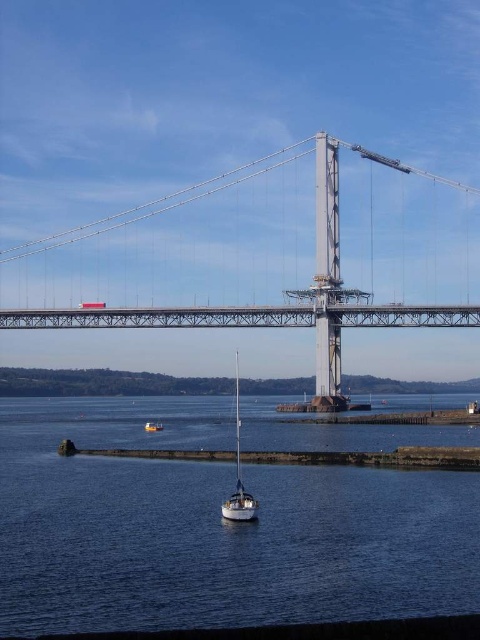
Can you confirm if metallic gray suspension bridge at center is shorter than white glossy sailboat at center?

No, metallic gray suspension bridge at center is not shorter than white glossy sailboat at center.

Is metallic gray suspension bridge at center closer to the viewer compared to white glossy sailboat at center?

That is False.

Locate an element on the screen. The image size is (480, 640). metallic gray suspension bridge at center is located at coordinates (253, 305).

This screenshot has height=640, width=480. I want to click on metallic gray suspension bridge at center, so click(253, 305).

Does white glossy sailboat at center have a larger size compared to orange fiberglass boat at lower center?

Yes, white glossy sailboat at center is bigger than orange fiberglass boat at lower center.

Can you confirm if white glossy sailboat at center is positioned to the left of orange fiberglass boat at lower center?

Incorrect, white glossy sailboat at center is not on the left side of orange fiberglass boat at lower center.

Image resolution: width=480 pixels, height=640 pixels. What do you see at coordinates (239, 476) in the screenshot? I see `white glossy sailboat at center` at bounding box center [239, 476].

Locate an element on the screen. This screenshot has height=640, width=480. white glossy sailboat at center is located at coordinates (239, 476).

Who is more distant from viewer, (121, 509) or (45, 250)?

Point (45, 250)

Does blue water at center appear on the right side of metallic gray suspension bridge at center?

Yes, blue water at center is to the right of metallic gray suspension bridge at center.

The image size is (480, 640). What do you see at coordinates (214, 528) in the screenshot?
I see `blue water at center` at bounding box center [214, 528].

You are a GUI agent. You are given a task and a screenshot of the screen. Output one action in this format:
    pyautogui.click(x=<x>, y=<y>)
    Task: Click on the blue water at center
    This screenshot has width=480, height=640.
    Given the screenshot: What is the action you would take?
    pyautogui.click(x=214, y=528)